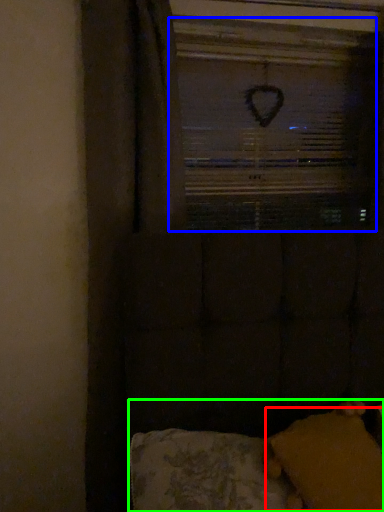
Question: Which is nearer to the pillow (highlighted by a red box)? window screen (highlighted by a blue box) or furniture (highlighted by a green box).

Choices:
 (A) window screen
 (B) furniture

Answer: (B)